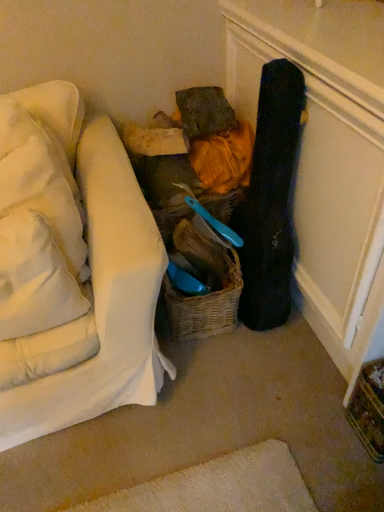
Question: Can you confirm if black matte guitar case at right is thinner than white soft pillow at left, positioned as the third pillow in top-to-bottom order?

Choices:
 (A) yes
 (B) no

Answer: (A)

Question: From a real-world perspective, does black matte guitar case at right stand above white soft pillow at left, marked as the first pillow in a bottom-to-top arrangement?

Choices:
 (A) yes
 (B) no

Answer: (B)

Question: Considering the relative sizes of black matte guitar case at right and white soft pillow at left, positioned as the third pillow in top-to-bottom order, in the image provided, is black matte guitar case at right smaller than white soft pillow at left, positioned as the third pillow in top-to-bottom order,?

Choices:
 (A) no
 (B) yes

Answer: (A)

Question: Does black matte guitar case at right have a greater width compared to white soft pillow at left, marked as the first pillow in a bottom-to-top arrangement?

Choices:
 (A) no
 (B) yes

Answer: (A)

Question: Could you tell me if black matte guitar case at right is facing white soft pillow at left, positioned as the third pillow in top-to-bottom order?

Choices:
 (A) yes
 (B) no

Answer: (A)

Question: In the image, is white soft pillow at upper left, which is counted as the 1th pillow, starting from the top, positioned in front of or behind woven brown basket at center, placed as the first basket when sorted from bottom to top?

Choices:
 (A) behind
 (B) front

Answer: (B)

Question: Is white soft pillow at upper left, the third pillow from the bottom, to the left or to the right of woven brown basket at center, placed as the 2th basket when sorted from top to bottom, in the image?

Choices:
 (A) right
 (B) left

Answer: (B)

Question: Is point 26,105 closer or farther from the camera than point 216,306?

Choices:
 (A) farther
 (B) closer

Answer: (B)

Question: Considering the positions of white soft pillow at upper left, which is counted as the 1th pillow, starting from the top, and woven brown basket at center, placed as the 2th basket when sorted from top to bottom, in the image, is white soft pillow at upper left, which is counted as the 1th pillow, starting from the top, bigger or smaller than woven brown basket at center, placed as the 2th basket when sorted from top to bottom,?

Choices:
 (A) small
 (B) big

Answer: (A)

Question: Considering the positions of woven brown basket at center, placed as the first basket when sorted from bottom to top, and white soft pillow at left, positioned as the 2th pillow in top-to-bottom order, in the image, is woven brown basket at center, placed as the first basket when sorted from bottom to top, wider or thinner than white soft pillow at left, positioned as the 2th pillow in top-to-bottom order,?

Choices:
 (A) wide
 (B) thin

Answer: (A)

Question: From their relative heights in the image, would you say woven brown basket at center, placed as the first basket when sorted from bottom to top, is taller or shorter than white soft pillow at left, positioned as the 2th pillow in top-to-bottom order?

Choices:
 (A) tall
 (B) short

Answer: (B)

Question: From a real-world perspective, is woven brown basket at center, placed as the first basket when sorted from bottom to top, above or below white soft pillow at left, positioned as the 2th pillow in top-to-bottom order?

Choices:
 (A) above
 (B) below

Answer: (B)

Question: Is woven brown basket at center, placed as the first basket when sorted from bottom to top, in front of or behind white soft pillow at left, arranged as the 2th pillow when ordered from the bottom, in the image?

Choices:
 (A) front
 (B) behind

Answer: (B)

Question: In terms of height, does white soft pillow at left, positioned as the 2th pillow in top-to-bottom order, look taller or shorter compared to woven brown basket at center, placed as the 2th basket when sorted from top to bottom?

Choices:
 (A) tall
 (B) short

Answer: (A)

Question: In terms of width, does white soft pillow at left, arranged as the 2th pillow when ordered from the bottom, look wider or thinner when compared to woven brown basket at center, placed as the 2th basket when sorted from top to bottom?

Choices:
 (A) thin
 (B) wide

Answer: (A)